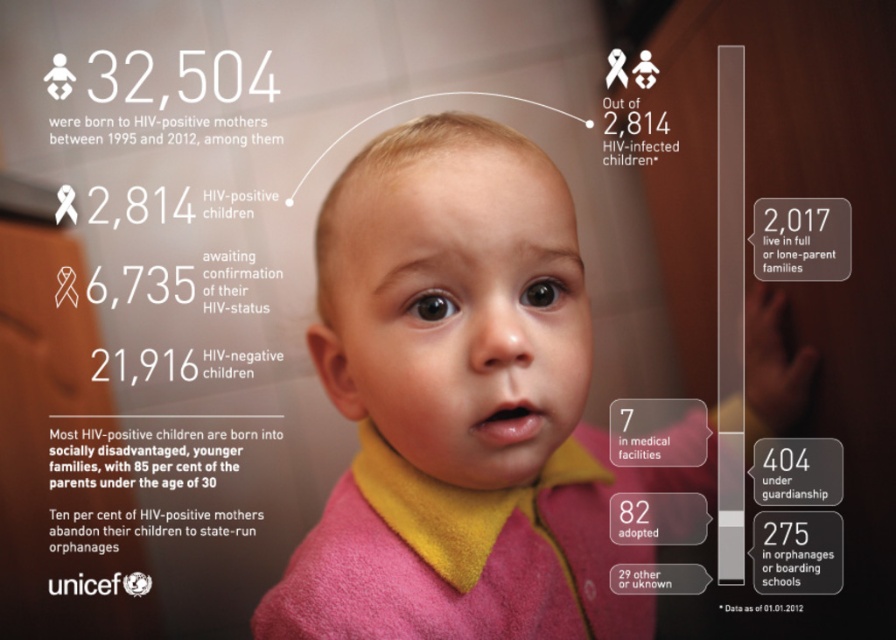
Based on the photo, does pink fleece jacket at center have a larger size compared to pink fleece robe at center?

Yes.

Does point (524, 216) come farther from viewer compared to point (584, 612)?

No.

Is point (384, 397) closer to viewer compared to point (515, 611)?

That is True.

The image size is (896, 640). I want to click on pink fleece jacket at center, so click(459, 404).